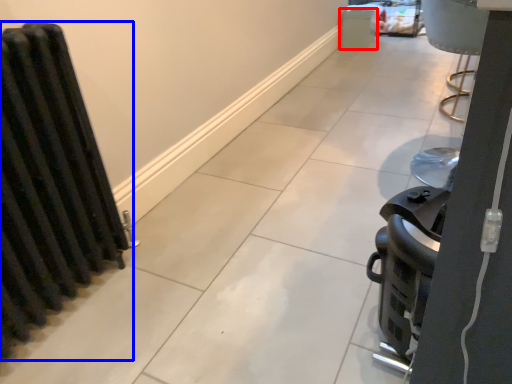
Question: Which point is closer to the camera, appliance (highlighted by a red box) or radiator (highlighted by a blue box)?

Choices:
 (A) appliance
 (B) radiator

Answer: (B)